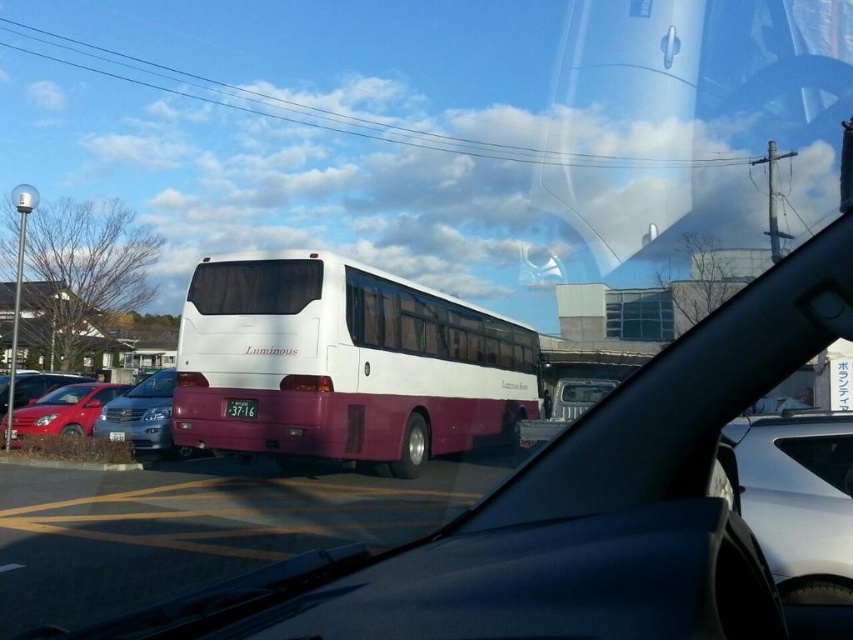
You are a passenger in the satin silver sedan at center. You notice a bus labeled Luminous in red text on its rear parked or moving slowly ahead. Where is the bus located relative to your current position?

The bus labeled Luminous in red text on its rear is ahead of the satin silver sedan at center.

You are sitting in the front passenger seat of the vehicle and notice two points marked on the windshield. The first point is at coordinates point (103, 438) and the second at point (54, 429). Which point is closer to your eyes?

Point (103, 438) is closer to the camera than point (54, 429), so the first point is closer to your eyes.

You are a passenger in the white matte bus at center and want to see the license plate of the satin silver sedan at center. Can you see it from your current position?

The white matte bus at center is in front of the satin silver sedan at center, so you cannot see the license plate of the satin silver sedan at center from your current position.